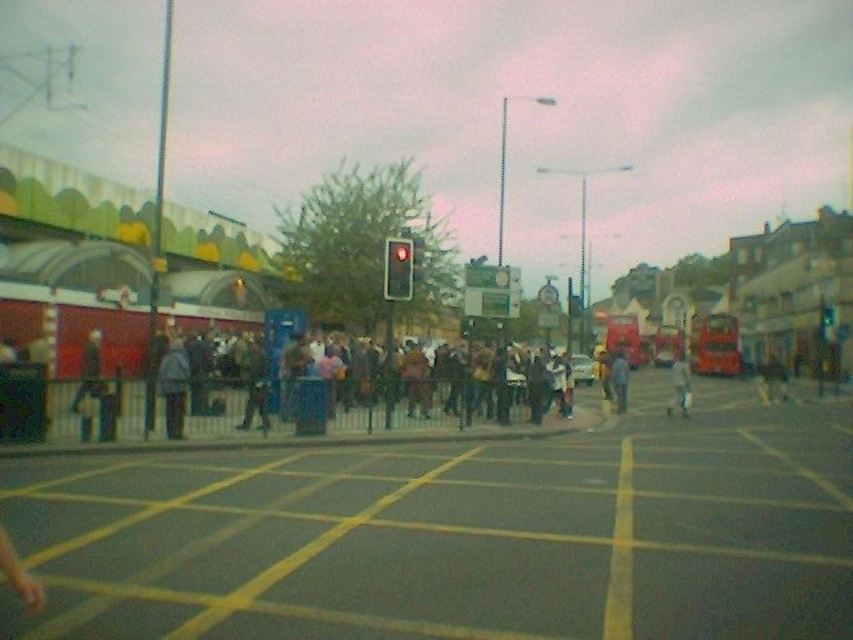
You are a pedestrian waiting at the crosswalk. You notice two people wearing jackets at the center of the scene. Which jacket is taller, the light gray jacket at center or the dark blue jacket at center?

The light gray jacket at center is taller than the dark blue jacket at center.

Based on the scene description, where is the brown fabric crowd at center located in the image?

The brown fabric crowd at center is located at point [271,396] in the image.